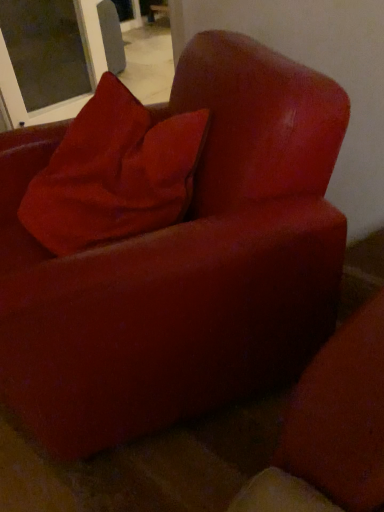
Question: Is velvet red pillow at upper left situated inside transparent glass screen door at upper left or outside?

Choices:
 (A) outside
 (B) inside

Answer: (A)

Question: Is point (71, 170) closer or farther from the camera than point (16, 31)?

Choices:
 (A) closer
 (B) farther

Answer: (A)

Question: In the image, is velvet red pillow at upper left positioned in front of or behind transparent glass screen door at upper left?

Choices:
 (A) behind
 (B) front

Answer: (B)

Question: Is transparent glass screen door at upper left spatially inside velvet red pillow at upper left, or outside of it?

Choices:
 (A) outside
 (B) inside

Answer: (A)

Question: Visually, is transparent glass screen door at upper left positioned to the left or to the right of velvet red pillow at upper left?

Choices:
 (A) left
 (B) right

Answer: (A)

Question: From a real-world perspective, is transparent glass screen door at upper left above or below velvet red pillow at upper left?

Choices:
 (A) below
 (B) above

Answer: (A)

Question: From their relative heights in the image, would you say transparent glass screen door at upper left is taller or shorter than velvet red pillow at upper left?

Choices:
 (A) tall
 (B) short

Answer: (A)